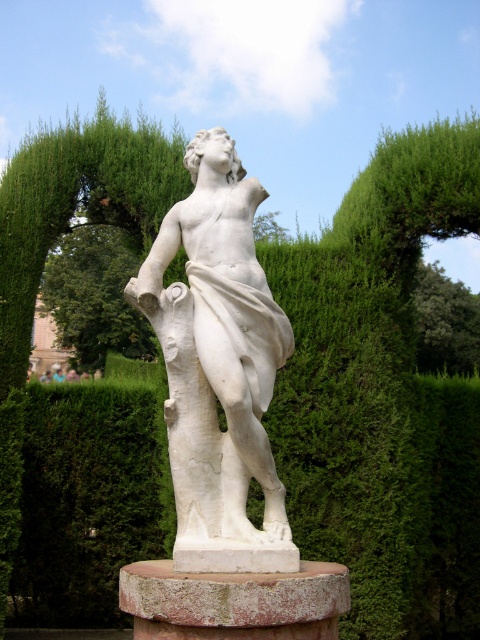
Question: Is white marble statue at center further to camera compared to green leafy tree at center?

Choices:
 (A) no
 (B) yes

Answer: (A)

Question: Which point is closer to the camera?

Choices:
 (A) green leafy tree at upper center
 (B) white marble statue at center
 (C) green leafy tree at center

Answer: (B)

Question: Does white marble statue at center have a smaller size compared to green leafy tree at center?

Choices:
 (A) no
 (B) yes

Answer: (A)

Question: Among these objects, which one is farthest from the camera?

Choices:
 (A) white marble statue at center
 (B) green leafy tree at upper center

Answer: (B)

Question: Is green leafy tree at center wider than green leafy tree at upper center?

Choices:
 (A) yes
 (B) no

Answer: (B)

Question: Which object appears closest to the camera in this image?

Choices:
 (A) white marble statue at center
 (B) green leafy tree at upper center
 (C) green leafy tree at center

Answer: (A)